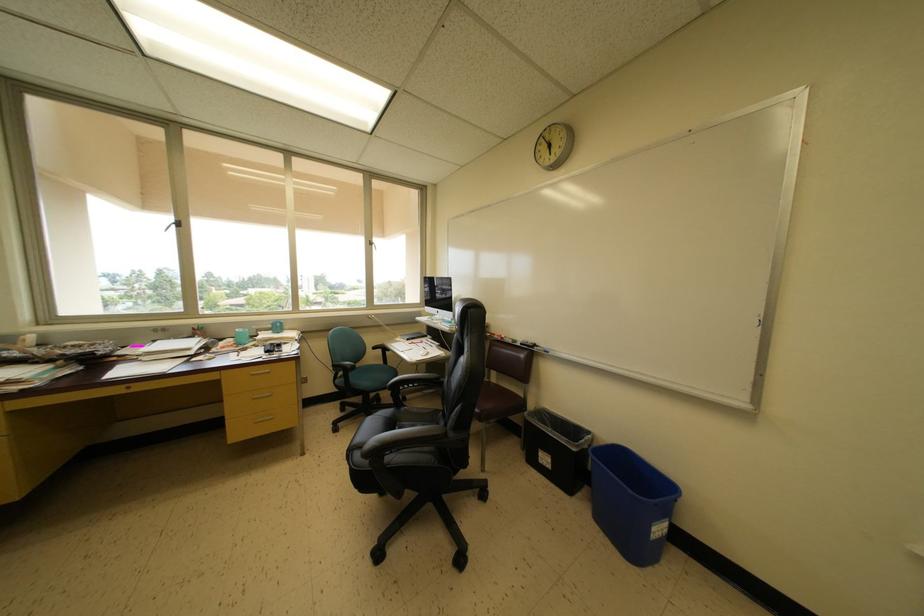
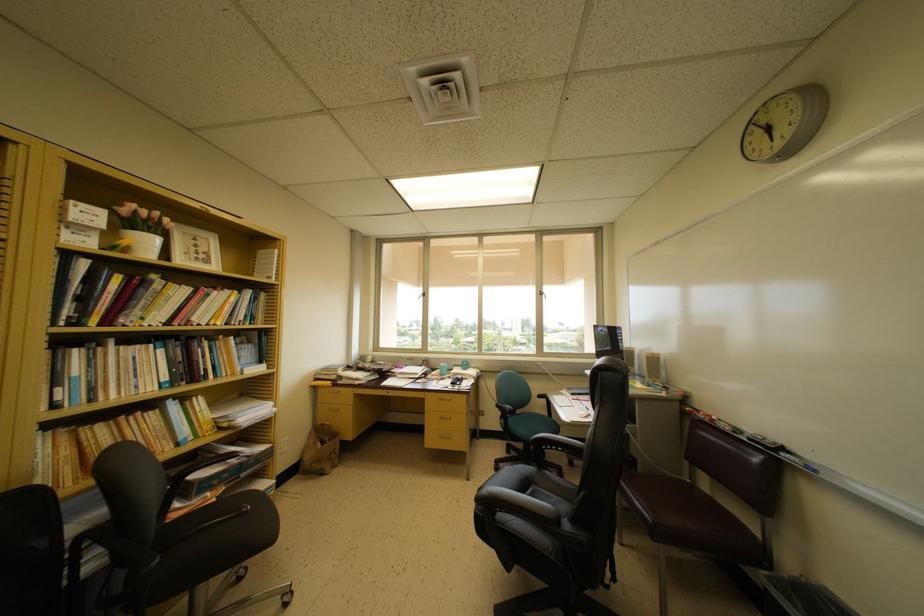
Find the pixel in the second image that matches [539,350] in the first image.

(786, 454)